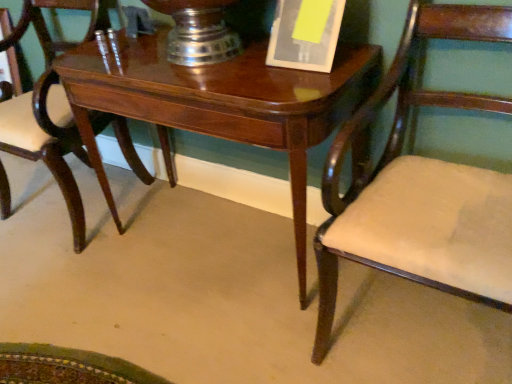
Question: Can you confirm if glossy wood table at center is positioned to the left of mahogany wood chair at center, marked as the 1th chair in a left-to-right arrangement?

Choices:
 (A) yes
 (B) no

Answer: (B)

Question: Is glossy wood table at center touching mahogany wood chair at center, marked as the 1th chair in a left-to-right arrangement?

Choices:
 (A) no
 (B) yes

Answer: (A)

Question: Can you confirm if glossy wood table at center is bigger than mahogany wood chair at center, marked as the 1th chair in a left-to-right arrangement?

Choices:
 (A) no
 (B) yes

Answer: (B)

Question: Are glossy wood table at center and mahogany wood chair at center, acting as the second chair starting from the right, far apart?

Choices:
 (A) no
 (B) yes

Answer: (A)

Question: From the image's perspective, would you say glossy wood table at center is shown under mahogany wood chair at center, acting as the second chair starting from the right?

Choices:
 (A) no
 (B) yes

Answer: (B)

Question: From a real-world perspective, does glossy wood table at center sit lower than mahogany wood chair at center, acting as the second chair starting from the right?

Choices:
 (A) yes
 (B) no

Answer: (A)

Question: Is glossy wood table at center to the right of matte wood chair at right, arranged as the 2th chair when viewed from the left, from the viewer's perspective?

Choices:
 (A) no
 (B) yes

Answer: (A)

Question: From the image's perspective, is glossy wood table at center on matte wood chair at right, which appears as the first chair when viewed from the right?

Choices:
 (A) yes
 (B) no

Answer: (A)

Question: Is glossy wood table at center looking in the opposite direction of matte wood chair at right, arranged as the 2th chair when viewed from the left?

Choices:
 (A) no
 (B) yes

Answer: (A)

Question: Does glossy wood table at center have a lesser width compared to matte wood chair at right, arranged as the 2th chair when viewed from the left?

Choices:
 (A) no
 (B) yes

Answer: (B)

Question: From a real-world perspective, does glossy wood table at center sit lower than matte wood chair at right, arranged as the 2th chair when viewed from the left?

Choices:
 (A) no
 (B) yes

Answer: (B)

Question: Is glossy wood table at center positioned behind matte wood chair at right, arranged as the 2th chair when viewed from the left?

Choices:
 (A) no
 (B) yes

Answer: (B)

Question: Does yellow paper at upper center contain matte wood chair at right, arranged as the 2th chair when viewed from the left?

Choices:
 (A) yes
 (B) no

Answer: (B)